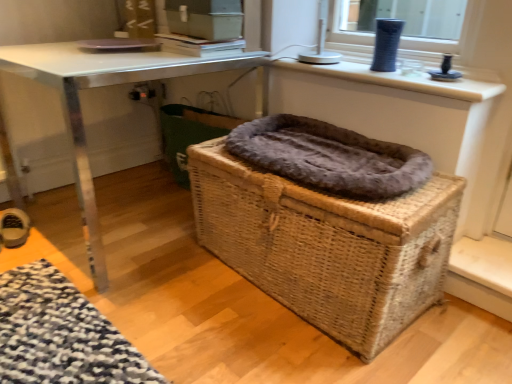
Where is `vacant area on top of woven brown basket at center (from a real-world perspective)`? vacant area on top of woven brown basket at center (from a real-world perspective) is located at coordinates (315, 153).